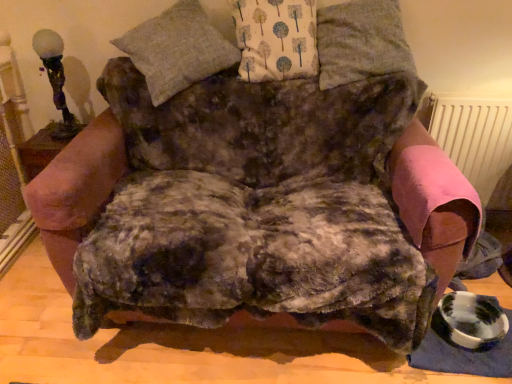
Image resolution: width=512 pixels, height=384 pixels. I want to click on pink fabric radiator at right, so click(x=475, y=140).

Based on the photo, what is the approximate height of white fabric with tree pattern at upper center, the 2th pillow viewed from the left?

white fabric with tree pattern at upper center, the 2th pillow viewed from the left, is 15.40 inches in height.

Describe the element at coordinates (55, 79) in the screenshot. This screenshot has width=512, height=384. I see `matte glass table lamp at upper left` at that location.

You are a GUI agent. You are given a task and a screenshot of the screen. Output one action in this format:
    pyautogui.click(x=<x>, y=<y>)
    Task: Click on the pink fabric radiator at right
    
    Given the screenshot: What is the action you would take?
    pyautogui.click(x=475, y=140)

Based on the photo, does gray woolen pillow at upper center, which is the 3th pillow in right-to-left order, have a smaller size compared to white fabric with tree pattern at upper center, the 2th pillow viewed from the left?

No.

Is white fabric with tree pattern at upper center, which is the 2th pillow in right-to-left order, located within gray woolen pillow at upper center, which is the 3th pillow in right-to-left order?

No, white fabric with tree pattern at upper center, which is the 2th pillow in right-to-left order, is not surrounded by gray woolen pillow at upper center, which is the 3th pillow in right-to-left order.

Are pink fabric radiator at right and gray fabric pillow at upper center, the first pillow in the right-to-left sequence, beside each other?

No, pink fabric radiator at right is not with gray fabric pillow at upper center, the first pillow in the right-to-left sequence.

Looking at this image, can you tell me how much pink fabric radiator at right and gray fabric pillow at upper center, the first pillow in the right-to-left sequence, differ in facing direction?

The facing directions of pink fabric radiator at right and gray fabric pillow at upper center, the first pillow in the right-to-left sequence, are 0.916 degrees apart.

Between pink fabric radiator at right and gray fabric pillow at upper center, the first pillow in the right-to-left sequence, which one is positioned in front?

gray fabric pillow at upper center, the first pillow in the right-to-left sequence, is more forward.

Which is correct: pink fabric radiator at right is inside gray fabric pillow at upper center, the first pillow in the right-to-left sequence, or outside of it?

pink fabric radiator at right lies outside gray fabric pillow at upper center, the first pillow in the right-to-left sequence.

From a real-world perspective, is white fabric with tree pattern at upper center, the 2th pillow viewed from the left, positioned above or below pink fabric radiator at right?

white fabric with tree pattern at upper center, the 2th pillow viewed from the left, is above pink fabric radiator at right.

Does white fabric with tree pattern at upper center, which is the 2th pillow in right-to-left order, touch pink fabric radiator at right?

No, white fabric with tree pattern at upper center, which is the 2th pillow in right-to-left order, is not beside pink fabric radiator at right.

Could pink fabric radiator at right be considered to be inside white fabric with tree pattern at upper center, which is the 2th pillow in right-to-left order?

Definitely not — pink fabric radiator at right is not inside white fabric with tree pattern at upper center, which is the 2th pillow in right-to-left order.

Considering the relative positions of matte glass table lamp at upper left and pink fabric radiator at right in the image provided, is matte glass table lamp at upper left behind pink fabric radiator at right?

No, the depth of matte glass table lamp at upper left is less than that of pink fabric radiator at right.

Does matte glass table lamp at upper left have a larger size compared to pink fabric radiator at right?

Actually, matte glass table lamp at upper left might be smaller than pink fabric radiator at right.

From a real-world perspective, is matte glass table lamp at upper left positioned under pink fabric radiator at right based on gravity?

No, from a real-world perspective, matte glass table lamp at upper left is not under pink fabric radiator at right.

Visually, is matte glass table lamp at upper left positioned to the left or to the right of pink fabric radiator at right?

matte glass table lamp at upper left is positioned on pink fabric radiator at right's left side.

The image size is (512, 384). In order to click on pillow that is the 2nd one when counting leftward from the gray fabric pillow at upper center, the first pillow in the right-to-left sequence in this screenshot , I will do pyautogui.click(x=177, y=49).

Is gray fabric pillow at upper center, which is the 3th pillow in left-to-right order, inside the boundaries of gray woolen pillow at upper center, which is the 3th pillow in right-to-left order, or outside?

The correct answer is: outside.

Is gray fabric pillow at upper center, the first pillow in the right-to-left sequence, closer to the viewer compared to gray woolen pillow at upper center, which is the 3th pillow in right-to-left order?

No, it is not.

Is gray fabric pillow at upper center, the first pillow in the right-to-left sequence, oriented away from gray woolen pillow at upper center, which appears as the first pillow when viewed from the left?

gray fabric pillow at upper center, the first pillow in the right-to-left sequence, is not turned away from gray woolen pillow at upper center, which appears as the first pillow when viewed from the left.

Considering the relative sizes of gray woolen pillow at upper center, which appears as the first pillow when viewed from the left, and pink fabric radiator at right in the image provided, is gray woolen pillow at upper center, which appears as the first pillow when viewed from the left, shorter than pink fabric radiator at right?

Indeed, gray woolen pillow at upper center, which appears as the first pillow when viewed from the left, has a lesser height compared to pink fabric radiator at right.

From the pink fabric radiator at right, count the 3rd pillow to the left and point to it. Please provide its 2D coordinates.

[(177, 49)]

Can you confirm if gray woolen pillow at upper center, which is the 3th pillow in right-to-left order, is bigger than pink fabric radiator at right?

Correct, gray woolen pillow at upper center, which is the 3th pillow in right-to-left order, is larger in size than pink fabric radiator at right.

Which point is more forward, (165, 26) or (492, 177)?

The point (165, 26) is closer to the camera.

Locate an element on the screen. pillow that is the 1st object above the matte glass table lamp at upper left (from a real-world perspective) is located at coordinates pyautogui.click(x=177, y=49).

Is matte glass table lamp at upper left far from gray woolen pillow at upper center, which is the 3th pillow in right-to-left order?

No, matte glass table lamp at upper left is not far away from gray woolen pillow at upper center, which is the 3th pillow in right-to-left order.

Is gray woolen pillow at upper center, which is the 3th pillow in right-to-left order, a part of matte glass table lamp at upper left?

No, gray woolen pillow at upper center, which is the 3th pillow in right-to-left order, is not inside matte glass table lamp at upper left.

Is matte glass table lamp at upper left further to the viewer compared to gray woolen pillow at upper center, which is the 3th pillow in right-to-left order?

Yes.

This screenshot has width=512, height=384. I want to click on the 2nd pillow below when counting from the white fabric with tree pattern at upper center, the 2th pillow viewed from the left (from the image's perspective), so click(x=177, y=49).

Locate an element on the screen. the 2nd pillow in front when counting from the pink fabric radiator at right is located at coordinates (361, 42).

When comparing their distances from gray fabric pillow at upper center, the first pillow in the right-to-left sequence, does gray woolen pillow at upper center, which appears as the first pillow when viewed from the left, or white fabric with tree pattern at upper center, the 2th pillow viewed from the left, seem closer?

white fabric with tree pattern at upper center, the 2th pillow viewed from the left, lies closer to gray fabric pillow at upper center, the first pillow in the right-to-left sequence, than the other object.

Which object lies nearer to the anchor point white fabric with tree pattern at upper center, the 2th pillow viewed from the left, matte glass table lamp at upper left or pink fabric radiator at right?

Among the two, pink fabric radiator at right is located nearer to white fabric with tree pattern at upper center, the 2th pillow viewed from the left.

Based on their spatial positions, is gray woolen pillow at upper center, which appears as the first pillow when viewed from the left, or matte glass table lamp at upper left closer to gray fabric pillow at upper center, the first pillow in the right-to-left sequence?

The object closer to gray fabric pillow at upper center, the first pillow in the right-to-left sequence, is gray woolen pillow at upper center, which appears as the first pillow when viewed from the left.

When comparing their distances from gray woolen pillow at upper center, which appears as the first pillow when viewed from the left, does matte glass table lamp at upper left or white fabric with tree pattern at upper center, the 2th pillow viewed from the left, seem further?

matte glass table lamp at upper left is positioned further to the anchor gray woolen pillow at upper center, which appears as the first pillow when viewed from the left.

Which object lies nearer to the anchor point gray woolen pillow at upper center, which appears as the first pillow when viewed from the left, gray fabric pillow at upper center, which is the 3th pillow in left-to-right order, or pink fabric radiator at right?

gray fabric pillow at upper center, which is the 3th pillow in left-to-right order.

Looking at the image, which one is located closer to white fabric with tree pattern at upper center, the 2th pillow viewed from the left, pink fabric radiator at right or gray woolen pillow at upper center, which is the 3th pillow in right-to-left order?

Among the two, gray woolen pillow at upper center, which is the 3th pillow in right-to-left order, is located nearer to white fabric with tree pattern at upper center, the 2th pillow viewed from the left.

Estimate the real-world distances between objects in this image. Which object is further from white fabric with tree pattern at upper center, which is the 2th pillow in right-to-left order, gray woolen pillow at upper center, which is the 3th pillow in right-to-left order, or matte glass table lamp at upper left?

matte glass table lamp at upper left is positioned further to the anchor white fabric with tree pattern at upper center, which is the 2th pillow in right-to-left order.

Based on their spatial positions, is gray fabric pillow at upper center, which is the 3th pillow in left-to-right order, or matte glass table lamp at upper left closer to gray woolen pillow at upper center, which appears as the first pillow when viewed from the left?

matte glass table lamp at upper left.

Where is `pillow between white fabric with tree pattern at upper center, which is the 2th pillow in right-to-left order, and pink fabric radiator at right, in the horizontal direction`? The width and height of the screenshot is (512, 384). pillow between white fabric with tree pattern at upper center, which is the 2th pillow in right-to-left order, and pink fabric radiator at right, in the horizontal direction is located at coordinates (361, 42).

Locate an element on the screen. The height and width of the screenshot is (384, 512). pillow between gray woolen pillow at upper center, which appears as the first pillow when viewed from the left, and gray fabric pillow at upper center, the first pillow in the right-to-left sequence, in the horizontal direction is located at coordinates point(276,38).

Where is `pillow located between matte glass table lamp at upper left and white fabric with tree pattern at upper center, the 2th pillow viewed from the left, in the left-right direction`? Image resolution: width=512 pixels, height=384 pixels. pillow located between matte glass table lamp at upper left and white fabric with tree pattern at upper center, the 2th pillow viewed from the left, in the left-right direction is located at coordinates (177, 49).